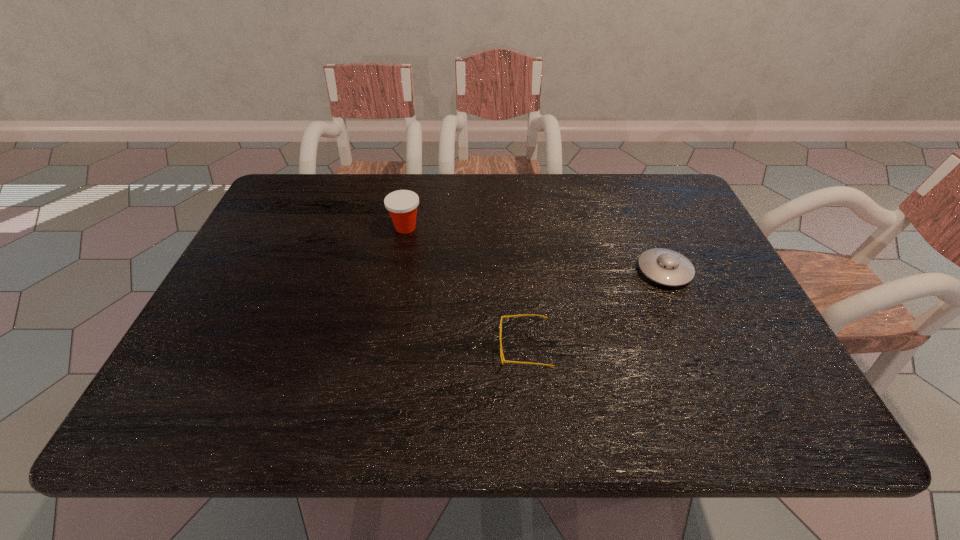
You are a GUI agent. You are given a task and a screenshot of the screen. Output one action in this format:
    pyautogui.click(x=<x>, y=<y>)
    Task: Click on the empty location between the Dixie cup and the nearest object
    The width and height of the screenshot is (960, 540).
    Given the screenshot: What is the action you would take?
    (x=465, y=287)

This screenshot has width=960, height=540. In order to click on vacant space in between the second farthest object and the shortest object in this screenshot , I will do `click(594, 309)`.

You are a GUI agent. You are given a task and a screenshot of the screen. Output one action in this format:
    pyautogui.click(x=<x>, y=<y>)
    Task: Click on the free space between the spectacles and the saucer
    This screenshot has width=960, height=540.
    Given the screenshot: What is the action you would take?
    pyautogui.click(x=594, y=309)

I want to click on unoccupied position between the second object from right to left and the rightmost object, so click(x=594, y=309).

Locate an element on the screen. This screenshot has height=540, width=960. unoccupied area between the second object from right to left and the saucer is located at coordinates (594, 309).

This screenshot has width=960, height=540. In order to click on unoccupied area between the second object from right to left and the Dixie cup in this screenshot , I will do `click(465, 287)`.

Identify the location of free space between the nearest object and the tallest object. (465, 287).

At what (x,y) coordinates should I click in order to perform the action: click on vacant space that's between the spectacles and the leftmost object. Please return your answer as a coordinate pair (x, y). Image resolution: width=960 pixels, height=540 pixels. Looking at the image, I should click on 465,287.

In order to click on object that is the closest to the Dixie cup in this screenshot , I will do `click(502, 317)`.

Point out which object is positioned as the second nearest to the Dixie cup. Please provide its 2D coordinates. Your answer should be formatted as a tuple, i.e. [(x, y)], where the tuple contains the x and y coordinates of a point satisfying the conditions above.

[(666, 267)]